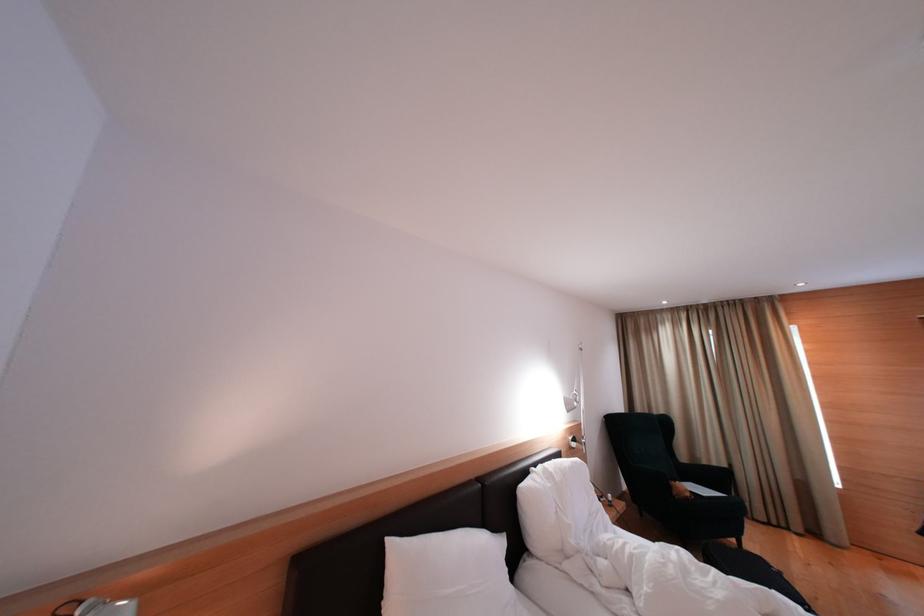
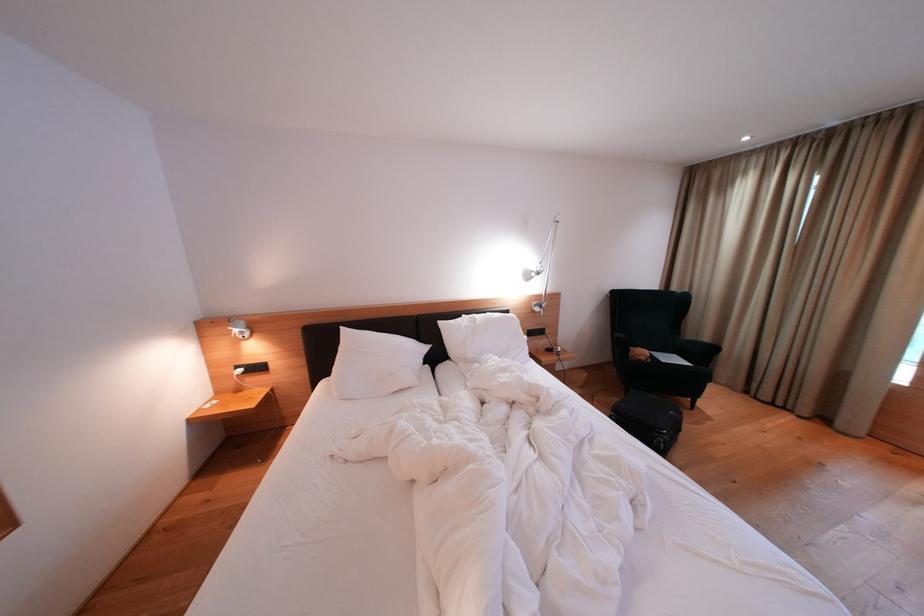
Find the pixel in the second image that matches pixel 396 546 in the first image.

(349, 333)